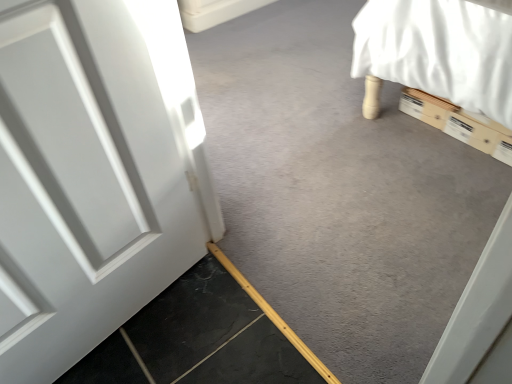
This screenshot has height=384, width=512. What do you see at coordinates (203, 338) in the screenshot? I see `smooth gray concrete at bottom left, which is counted as the second concrete, starting from the top` at bounding box center [203, 338].

Where is `smooth gray concrete at bottom left, which is counted as the second concrete, starting from the top`? smooth gray concrete at bottom left, which is counted as the second concrete, starting from the top is located at coordinates (203, 338).

The image size is (512, 384). I want to click on smooth gray concrete at lower left, the first concrete in the top-to-bottom sequence, so click(339, 191).

What do you see at coordinates (339, 191) in the screenshot?
I see `smooth gray concrete at lower left, the first concrete in the top-to-bottom sequence` at bounding box center [339, 191].

What is the approximate height of smooth gray concrete at lower left, the first concrete in the top-to-bottom sequence?

smooth gray concrete at lower left, the first concrete in the top-to-bottom sequence, is 0.94 inches in height.

Find the location of `smooth gray concrete at bottom left, acting as the first concrete starting from the bottom`. smooth gray concrete at bottom left, acting as the first concrete starting from the bottom is located at coordinates (203, 338).

Considering the relative positions of smooth gray concrete at lower left, the second concrete in the bottom-to-top sequence, and smooth gray concrete at bottom left, which is counted as the second concrete, starting from the top, in the image provided, is smooth gray concrete at lower left, the second concrete in the bottom-to-top sequence, to the right of smooth gray concrete at bottom left, which is counted as the second concrete, starting from the top, from the viewer's perspective?

Yes, smooth gray concrete at lower left, the second concrete in the bottom-to-top sequence, is to the right of smooth gray concrete at bottom left, which is counted as the second concrete, starting from the top.

Between smooth gray concrete at lower left, the second concrete in the bottom-to-top sequence, and smooth gray concrete at bottom left, which is counted as the second concrete, starting from the top, which one is positioned in front?

smooth gray concrete at bottom left, which is counted as the second concrete, starting from the top.

Is point (279, 152) more distant than point (263, 350)?

Yes, it is behind point (263, 350).

From the image's perspective, which object appears higher, smooth gray concrete at lower left, the first concrete in the top-to-bottom sequence, or smooth gray concrete at bottom left, acting as the first concrete starting from the bottom?

smooth gray concrete at lower left, the first concrete in the top-to-bottom sequence.

From a real-world perspective, which object rests below the other?

smooth gray concrete at lower left, the first concrete in the top-to-bottom sequence.

Considering the sizes of smooth gray concrete at lower left, the second concrete in the bottom-to-top sequence, and smooth gray concrete at bottom left, acting as the first concrete starting from the bottom, in the image, is smooth gray concrete at lower left, the second concrete in the bottom-to-top sequence, wider or thinner than smooth gray concrete at bottom left, acting as the first concrete starting from the bottom,?

In the image, smooth gray concrete at lower left, the second concrete in the bottom-to-top sequence, appears to be wider than smooth gray concrete at bottom left, acting as the first concrete starting from the bottom.

Does smooth gray concrete at lower left, the first concrete in the top-to-bottom sequence, have a lesser height compared to smooth gray concrete at bottom left, which is counted as the second concrete, starting from the top?

Indeed, smooth gray concrete at lower left, the first concrete in the top-to-bottom sequence, has a lesser height compared to smooth gray concrete at bottom left, which is counted as the second concrete, starting from the top.

Does smooth gray concrete at lower left, the first concrete in the top-to-bottom sequence, have a smaller size compared to smooth gray concrete at bottom left, which is counted as the second concrete, starting from the top?

No.

Is smooth gray concrete at lower left, the second concrete in the bottom-to-top sequence, not inside smooth gray concrete at bottom left, acting as the first concrete starting from the bottom?

Absolutely, smooth gray concrete at lower left, the second concrete in the bottom-to-top sequence, is external to smooth gray concrete at bottom left, acting as the first concrete starting from the bottom.

Would you consider smooth gray concrete at lower left, the first concrete in the top-to-bottom sequence, to be distant from smooth gray concrete at bottom left, which is counted as the second concrete, starting from the top?

No, smooth gray concrete at lower left, the first concrete in the top-to-bottom sequence, is in close proximity to smooth gray concrete at bottom left, which is counted as the second concrete, starting from the top.

Does smooth gray concrete at lower left, the first concrete in the top-to-bottom sequence, turn towards smooth gray concrete at bottom left, acting as the first concrete starting from the bottom?

Yes, smooth gray concrete at lower left, the first concrete in the top-to-bottom sequence, is turned towards smooth gray concrete at bottom left, acting as the first concrete starting from the bottom.

Can you tell me how much smooth gray concrete at lower left, the second concrete in the bottom-to-top sequence, and smooth gray concrete at bottom left, which is counted as the second concrete, starting from the top, differ in facing direction?

180 degrees.

How far apart are smooth gray concrete at lower left, the first concrete in the top-to-bottom sequence, and smooth gray concrete at bottom left, acting as the first concrete starting from the bottom?

They are 19.07 inches apart.

The height and width of the screenshot is (384, 512). I want to click on concrete on the left of smooth gray concrete at lower left, the first concrete in the top-to-bottom sequence, so click(203, 338).

Considering the relative positions of smooth gray concrete at bottom left, acting as the first concrete starting from the bottom, and smooth gray concrete at lower left, the second concrete in the bottom-to-top sequence, in the image provided, is smooth gray concrete at bottom left, acting as the first concrete starting from the bottom, to the right of smooth gray concrete at lower left, the second concrete in the bottom-to-top sequence, from the viewer's perspective?

Incorrect, smooth gray concrete at bottom left, acting as the first concrete starting from the bottom, is not on the right side of smooth gray concrete at lower left, the second concrete in the bottom-to-top sequence.

Considering the relative positions of smooth gray concrete at bottom left, which is counted as the second concrete, starting from the top, and smooth gray concrete at lower left, the first concrete in the top-to-bottom sequence, in the image provided, is smooth gray concrete at bottom left, which is counted as the second concrete, starting from the top, behind smooth gray concrete at lower left, the first concrete in the top-to-bottom sequence,?

No, smooth gray concrete at bottom left, which is counted as the second concrete, starting from the top, is in front of smooth gray concrete at lower left, the first concrete in the top-to-bottom sequence.

Is point (309, 364) positioned after point (346, 153)?

That is False.

From the image's perspective, is smooth gray concrete at bottom left, acting as the first concrete starting from the bottom, positioned above or below smooth gray concrete at lower left, the second concrete in the bottom-to-top sequence?

smooth gray concrete at bottom left, acting as the first concrete starting from the bottom, is situated lower than smooth gray concrete at lower left, the second concrete in the bottom-to-top sequence, in the image.

From a real-world perspective, is smooth gray concrete at bottom left, which is counted as the second concrete, starting from the top, on smooth gray concrete at lower left, the second concrete in the bottom-to-top sequence?

Indeed, from a real-world perspective, smooth gray concrete at bottom left, which is counted as the second concrete, starting from the top, stands above smooth gray concrete at lower left, the second concrete in the bottom-to-top sequence.

Between smooth gray concrete at bottom left, which is counted as the second concrete, starting from the top, and smooth gray concrete at lower left, the second concrete in the bottom-to-top sequence, which one has smaller width?

smooth gray concrete at bottom left, which is counted as the second concrete, starting from the top.

Between smooth gray concrete at bottom left, which is counted as the second concrete, starting from the top, and smooth gray concrete at lower left, the second concrete in the bottom-to-top sequence, which one has more height?

Standing taller between the two is smooth gray concrete at bottom left, which is counted as the second concrete, starting from the top.

Considering the sizes of objects smooth gray concrete at bottom left, which is counted as the second concrete, starting from the top, and smooth gray concrete at lower left, the first concrete in the top-to-bottom sequence, in the image provided, who is bigger, smooth gray concrete at bottom left, which is counted as the second concrete, starting from the top, or smooth gray concrete at lower left, the first concrete in the top-to-bottom sequence,?

smooth gray concrete at lower left, the first concrete in the top-to-bottom sequence.

Is smooth gray concrete at bottom left, which is counted as the second concrete, starting from the top, inside the boundaries of smooth gray concrete at lower left, the second concrete in the bottom-to-top sequence, or outside?

smooth gray concrete at bottom left, which is counted as the second concrete, starting from the top, is spatially situated outside smooth gray concrete at lower left, the second concrete in the bottom-to-top sequence.

Is smooth gray concrete at bottom left, which is counted as the second concrete, starting from the top, touching smooth gray concrete at lower left, the first concrete in the top-to-bottom sequence?

No, smooth gray concrete at bottom left, which is counted as the second concrete, starting from the top, is not beside smooth gray concrete at lower left, the first concrete in the top-to-bottom sequence.

Is smooth gray concrete at lower left, the second concrete in the bottom-to-top sequence, at the back of smooth gray concrete at bottom left, acting as the first concrete starting from the bottom?

smooth gray concrete at bottom left, acting as the first concrete starting from the bottom, does not have its back to smooth gray concrete at lower left, the second concrete in the bottom-to-top sequence.

How different are the orientations of smooth gray concrete at bottom left, acting as the first concrete starting from the bottom, and smooth gray concrete at lower left, the first concrete in the top-to-bottom sequence, in degrees?

180 degrees separate the facing orientations of smooth gray concrete at bottom left, acting as the first concrete starting from the bottom, and smooth gray concrete at lower left, the first concrete in the top-to-bottom sequence.

Identify the location of concrete below the smooth gray concrete at lower left, the second concrete in the bottom-to-top sequence (from the image's perspective). The width and height of the screenshot is (512, 384). (203, 338).

Find the location of a particular element. concrete above the smooth gray concrete at bottom left, which is counted as the second concrete, starting from the top (from the image's perspective) is located at coordinates (339, 191).

Find the location of a particular element. The width and height of the screenshot is (512, 384). concrete positioned vertically above the smooth gray concrete at lower left, the first concrete in the top-to-bottom sequence (from a real-world perspective) is located at coordinates (203, 338).